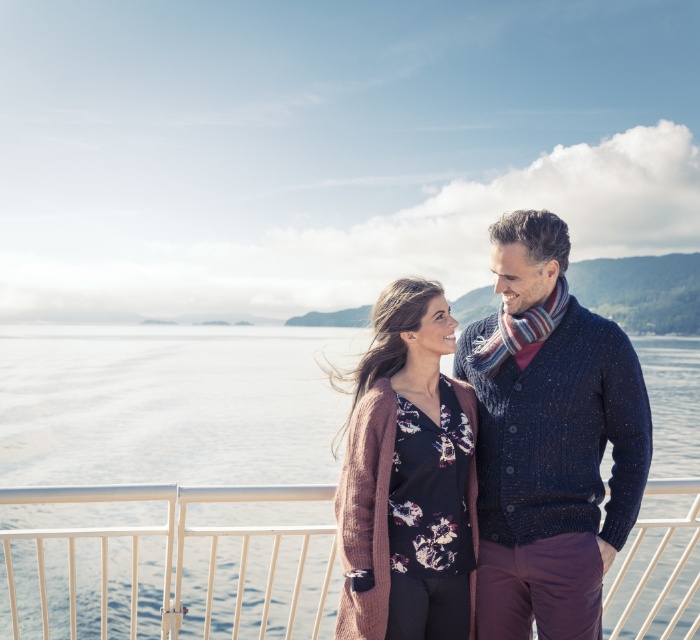
Between knitted navy sweater at center and rustic knit cardigan at center, which one has more height?

knitted navy sweater at center is taller.

Is knitted navy sweater at center wider than rustic knit cardigan at center?

Indeed, knitted navy sweater at center has a greater width compared to rustic knit cardigan at center.

Is point (550, 291) positioned before point (396, 296)?

Yes, it is.

You are a GUI agent. You are given a task and a screenshot of the screen. Output one action in this format:
    pyautogui.click(x=<x>, y=<y>)
    Task: Click on the knitted navy sweater at center
    The height and width of the screenshot is (640, 700).
    Given the screenshot: What is the action you would take?
    (550, 442)

Is clear water at center positioned before knitted navy sweater at center?

No, it is not.

Can you confirm if clear water at center is bigger than knitted navy sweater at center?

Yes.

Measure the distance between clear water at center and camera.

5.19 meters

The image size is (700, 640). Identify the location of clear water at center. (168, 403).

Who is taller, clear water at center or rustic knit cardigan at center?

Standing taller between the two is clear water at center.

Is clear water at center closer to camera compared to rustic knit cardigan at center?

No, clear water at center is behind rustic knit cardigan at center.

The height and width of the screenshot is (640, 700). I want to click on clear water at center, so click(x=168, y=403).